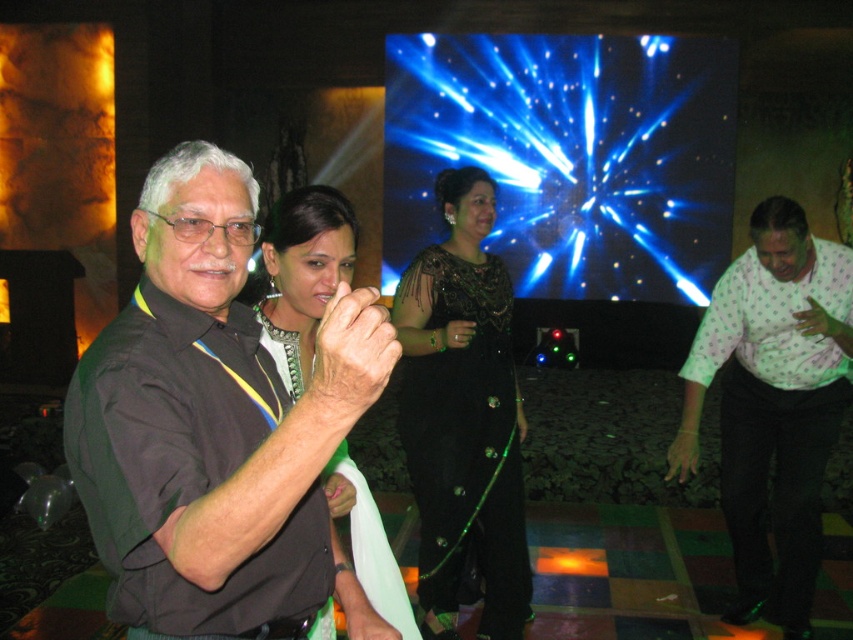
Question: Which object is positioned closest to the white dotted shirt at right?

Choices:
 (A) black satin dress at center
 (B) black matte shirt at center

Answer: (A)

Question: Which object is positioned farthest from the black satin dress at center?

Choices:
 (A) green beaded necklace at center
 (B) white dotted shirt at right
 (C) black matte shirt at center

Answer: (C)

Question: Which point is farther to the camera?

Choices:
 (A) (688, 404)
 (B) (273, 259)

Answer: (A)

Question: Is black matte shirt at center above black satin dress at center?

Choices:
 (A) yes
 (B) no

Answer: (A)

Question: Can you confirm if black matte shirt at center is positioned above black satin dress at center?

Choices:
 (A) no
 (B) yes

Answer: (B)

Question: Does white dotted shirt at right lie behind black satin dress at center?

Choices:
 (A) no
 (B) yes

Answer: (B)